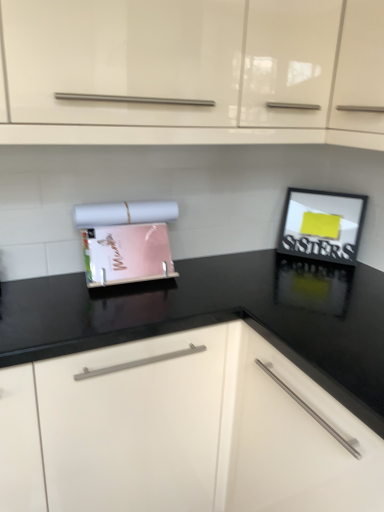
Question: Can you confirm if black matte picture frame at upper right is smaller than black glossy countertop at center, placed as the 2th cabinetry when sorted from top to bottom?

Choices:
 (A) no
 (B) yes

Answer: (B)

Question: Does black matte picture frame at upper right have a lesser width compared to black glossy countertop at center, the first cabinetry in the bottom-to-top sequence?

Choices:
 (A) no
 (B) yes

Answer: (B)

Question: Is black matte picture frame at upper right next to black glossy countertop at center, the first cabinetry in the bottom-to-top sequence, and touching it?

Choices:
 (A) yes
 (B) no

Answer: (B)

Question: Is black glossy countertop at center, placed as the 2th cabinetry when sorted from top to bottom, a part of black matte picture frame at upper right?

Choices:
 (A) yes
 (B) no

Answer: (B)

Question: From the image's perspective, is black matte picture frame at upper right located beneath black glossy countertop at center, placed as the 2th cabinetry when sorted from top to bottom?

Choices:
 (A) yes
 (B) no

Answer: (B)

Question: Is the depth of black matte picture frame at upper right greater than that of black glossy countertop at center, placed as the 2th cabinetry when sorted from top to bottom?

Choices:
 (A) yes
 (B) no

Answer: (A)

Question: Is glossy white cabinet at upper center, which appears as the 1th cabinetry when viewed from the top, closer to camera compared to black matte picture frame at upper right?

Choices:
 (A) no
 (B) yes

Answer: (B)

Question: Is glossy white cabinet at upper center, which appears as the 1th cabinetry when viewed from the top, in contact with black matte picture frame at upper right?

Choices:
 (A) yes
 (B) no

Answer: (B)

Question: Does glossy white cabinet at upper center, which appears as the 1th cabinetry when viewed from the top, turn towards black matte picture frame at upper right?

Choices:
 (A) yes
 (B) no

Answer: (B)

Question: From the image's perspective, does glossy white cabinet at upper center, which appears as the 1th cabinetry when viewed from the top, appear higher than black matte picture frame at upper right?

Choices:
 (A) yes
 (B) no

Answer: (A)

Question: Considering the relative sizes of glossy white cabinet at upper center, the second cabinetry in the bottom-to-top sequence, and black matte picture frame at upper right in the image provided, is glossy white cabinet at upper center, the second cabinetry in the bottom-to-top sequence, thinner than black matte picture frame at upper right?

Choices:
 (A) no
 (B) yes

Answer: (A)

Question: Does glossy white cabinet at upper center, the second cabinetry in the bottom-to-top sequence, have a greater height compared to black matte picture frame at upper right?

Choices:
 (A) yes
 (B) no

Answer: (A)

Question: Is black matte picture frame at upper right bigger than matte plastic magazine holder at center?

Choices:
 (A) no
 (B) yes

Answer: (A)